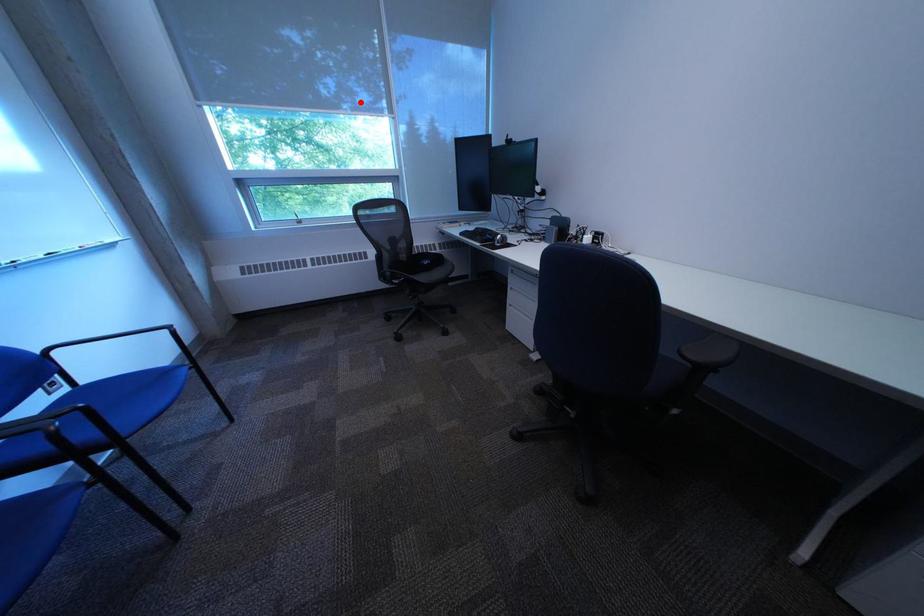
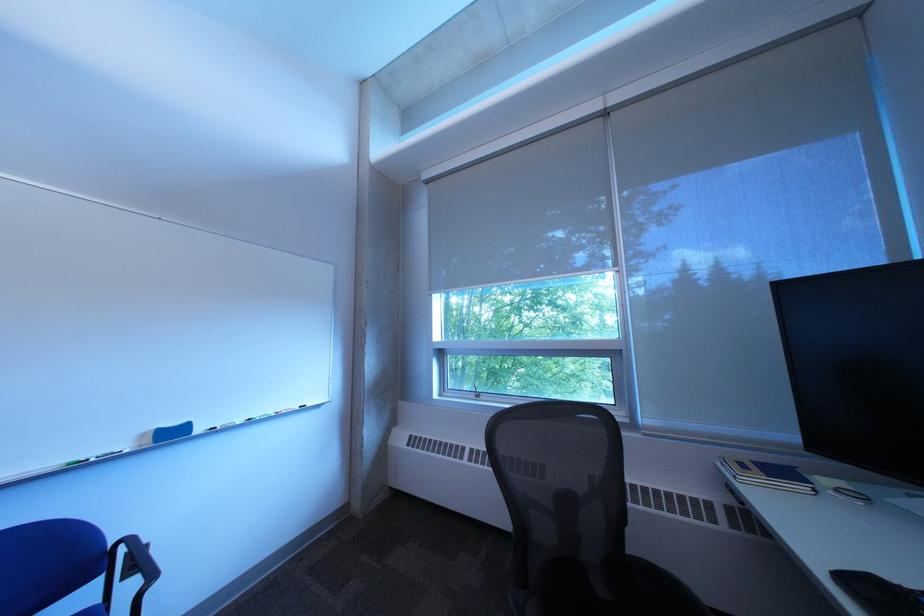
Question: I am providing you with two images of the same scene from different viewpoints. Given a red point in image1, look at the same physical point in image2. Is it:

Choices:
 (A) Closer to the viewpoint
 (B) Farther from the viewpoint

Answer: (A)